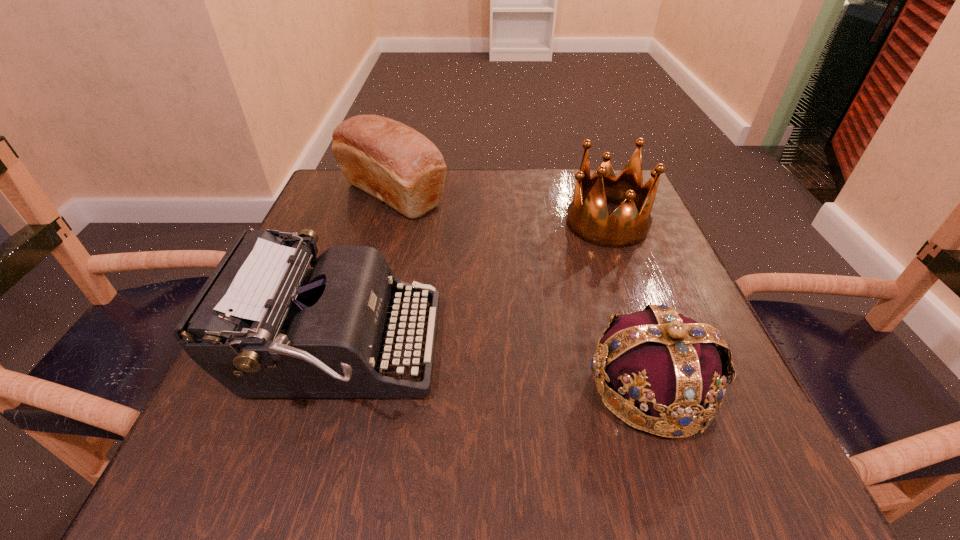
Identify the location of typewriter that is at the near edge. (264, 325).

You are a GUI agent. You are given a task and a screenshot of the screen. Output one action in this format:
    pyautogui.click(x=<x>, y=<y>)
    Task: Click on the crown at the near edge
    The height and width of the screenshot is (540, 960).
    Given the screenshot: What is the action you would take?
    pyautogui.click(x=670, y=365)

Image resolution: width=960 pixels, height=540 pixels. Identify the location of bread situated at the left edge. pyautogui.click(x=394, y=163).

This screenshot has width=960, height=540. In order to click on typewriter at the left edge in this screenshot , I will do `click(264, 325)`.

At what (x,y) coordinates should I click in order to perform the action: click on object that is at the far left corner. Please return your answer as a coordinate pair (x, y). Looking at the image, I should click on (394, 163).

Locate an element on the screen. Image resolution: width=960 pixels, height=540 pixels. object situated at the near left corner is located at coordinates (264, 325).

Where is `object that is at the far right corner`? Image resolution: width=960 pixels, height=540 pixels. object that is at the far right corner is located at coordinates (588, 218).

Where is `object located at the near right corner`? object located at the near right corner is located at coordinates (670, 365).

Locate an element on the screen. This screenshot has height=540, width=960. free location at the far edge is located at coordinates (537, 191).

What are the coordinates of `free space at the near edge` in the screenshot? It's located at (517, 483).